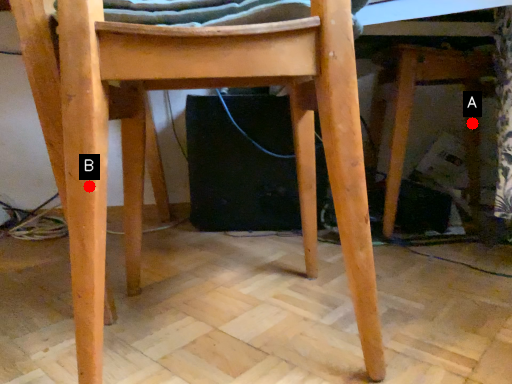
Question: Two points are circled on the image, labeled by A and B beside each circle. Which point is closer to the camera?

Choices:
 (A) A is closer
 (B) B is closer

Answer: (B)